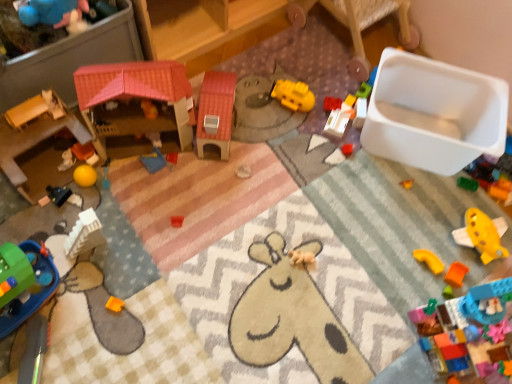
Where is `free area in between bright red plastic blocks at center, which ranks as the ninth toy in left-to-right order, and black plastic toy at lower left, the 13th toy from the right`? The image size is (512, 384). free area in between bright red plastic blocks at center, which ranks as the ninth toy in left-to-right order, and black plastic toy at lower left, the 13th toy from the right is located at coordinates (223, 148).